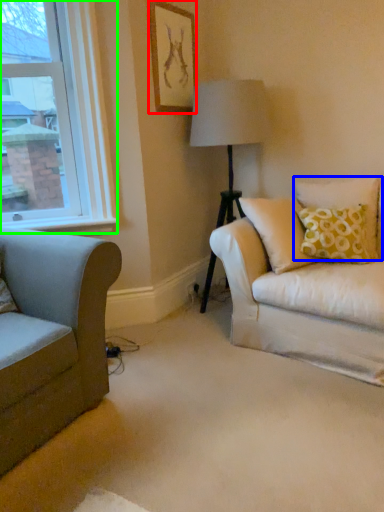
Question: Based on their relative distances, which object is farther from picture frame (highlighted by a red box)? Choose from pillow (highlighted by a blue box) and window (highlighted by a green box).

Choices:
 (A) pillow
 (B) window

Answer: (A)